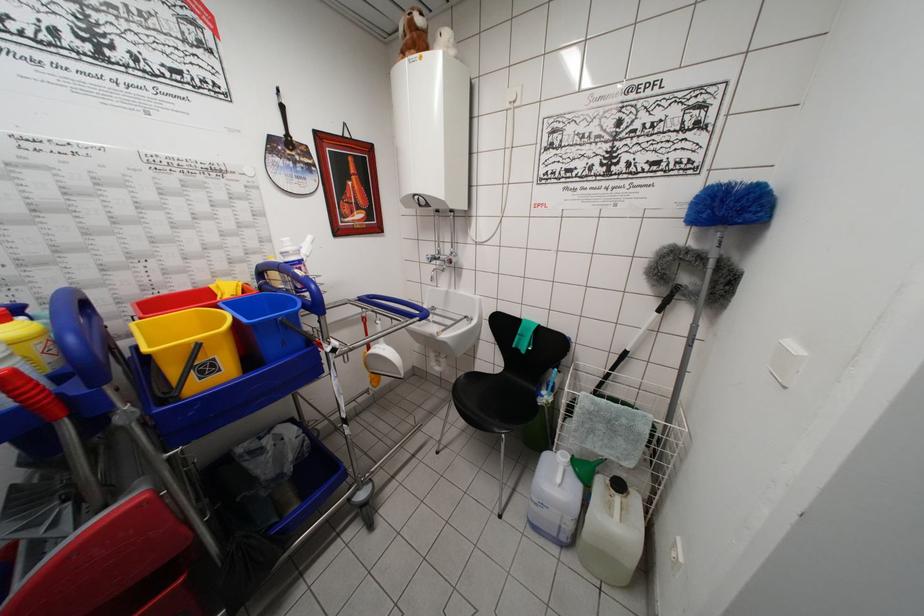
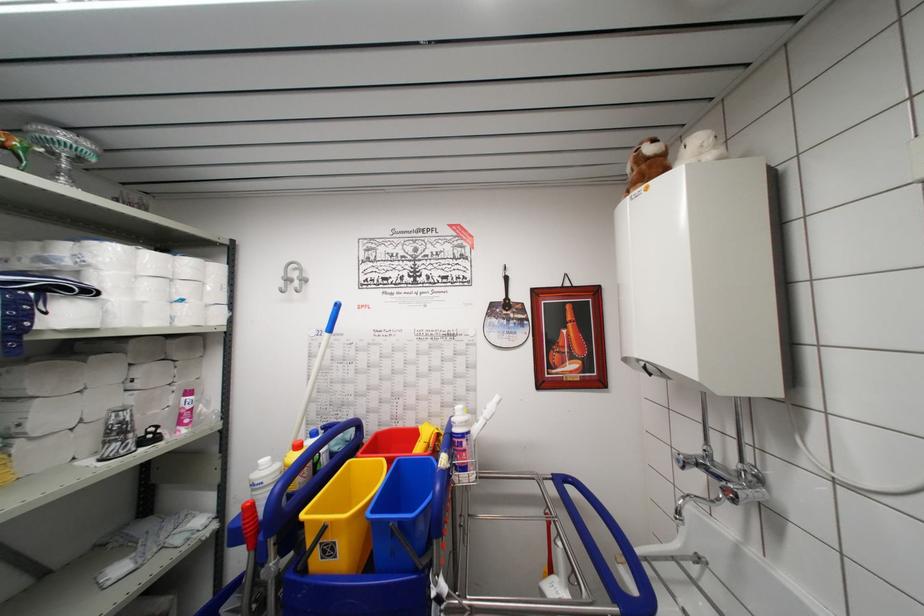
Find the pixel in the second image that matches pixel 94 315 in the first image.

(361, 439)